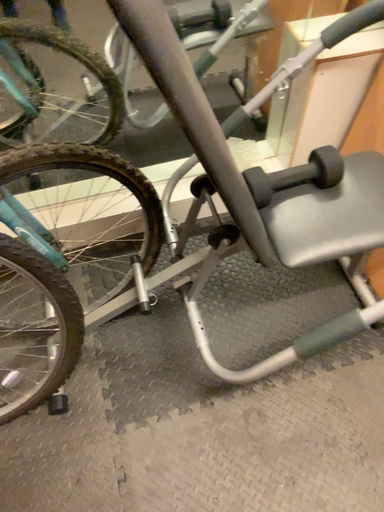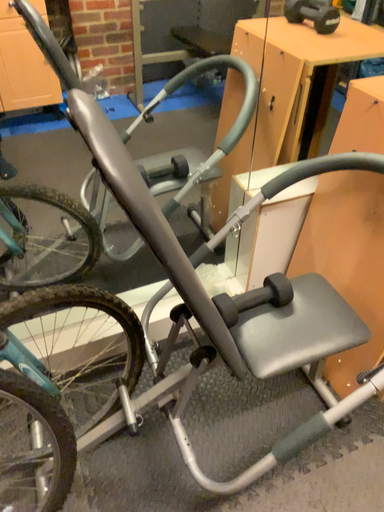
Question: How did the camera likely rotate when shooting the video?

Choices:
 (A) rotated upward
 (B) rotated downward

Answer: (A)